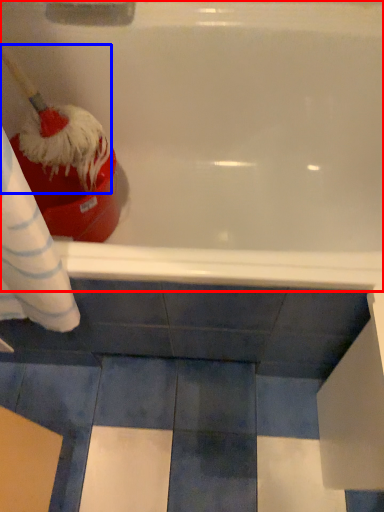
Question: Which object is closer to the camera taking this photo, bathtub (highlighted by a red box) or brush (highlighted by a blue box)?

Choices:
 (A) bathtub
 (B) brush

Answer: (B)